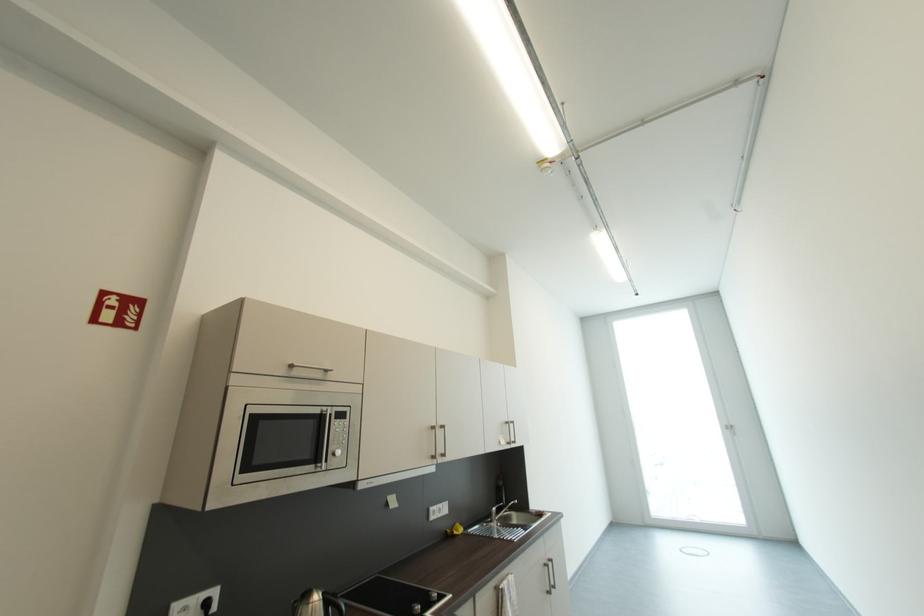
The width and height of the screenshot is (924, 616). I want to click on white power outlet, so click(x=196, y=602).